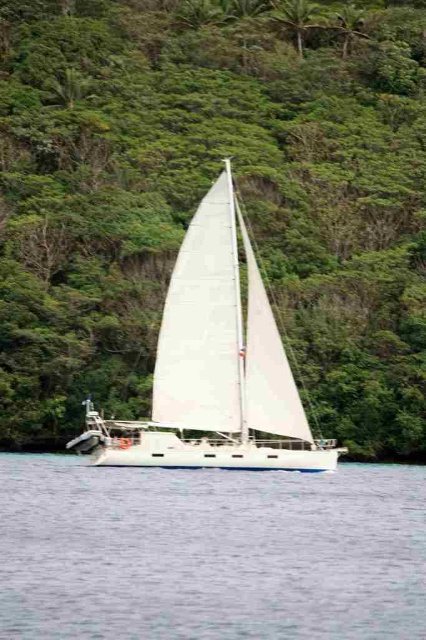
You are standing on the deck of a cruise ship that is 10 meters long. You want to move from the front to the back of the ship while avoiding stepping into the clear blue water at center. Is there enough space on the deck to walk from front to back without entering the water?

The clear blue water at center is 22.31 meters away from the viewer, which is farther than the 10 meter length of the cruise ship. Therefore, the entire deck of the ship is above land, so you can safely walk from front to back without entering the water.

Looking at this image, you are a photographer trying to capture the sailboat and the hillside in a single shot. You notice two points of interest marked as point 1 and point 2. Point 1 is at coordinates point (77, 163) and point 2 is at point (402, 636). Which point is closer to your camera position?

Point (77, 163) is further to the camera than point (402, 636), so point 2 is closer to the camera.

You are a photographer planning to capture the entire scene of the green leafy tree at center and the clear blue water at center in one shot. Based on their sizes, which object should you focus on to ensure both are visible without cropping?

The green leafy tree at center has a larger width than the clear blue water at center, so focusing on the tree will ensure both objects are visible without cropping.